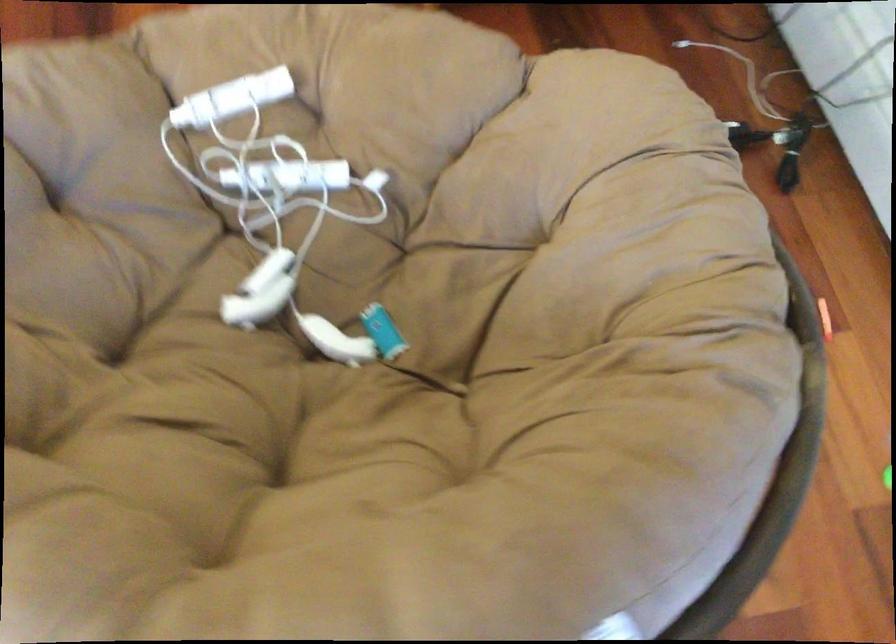
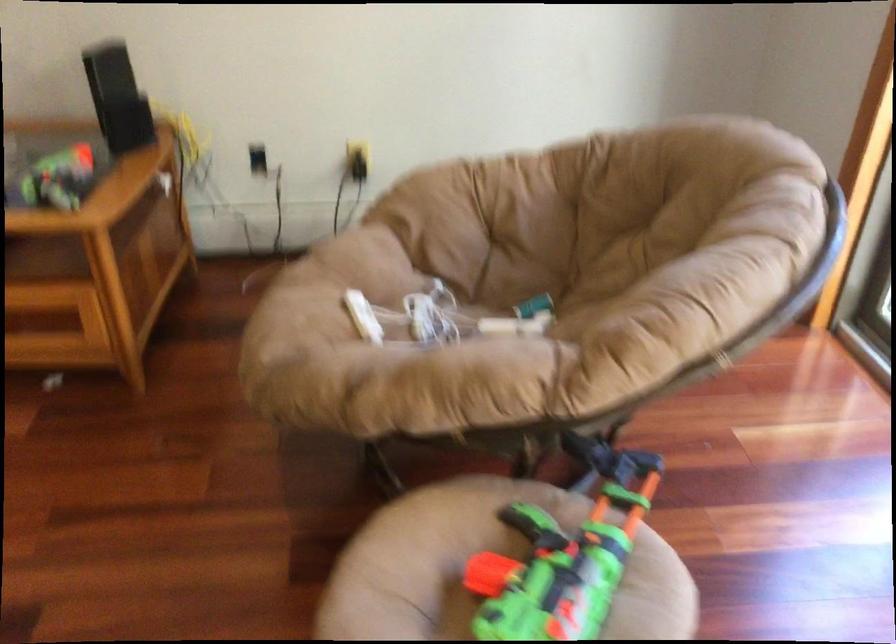
Find the pixel in the second image that matches (234,98) in the first image.

(363, 317)